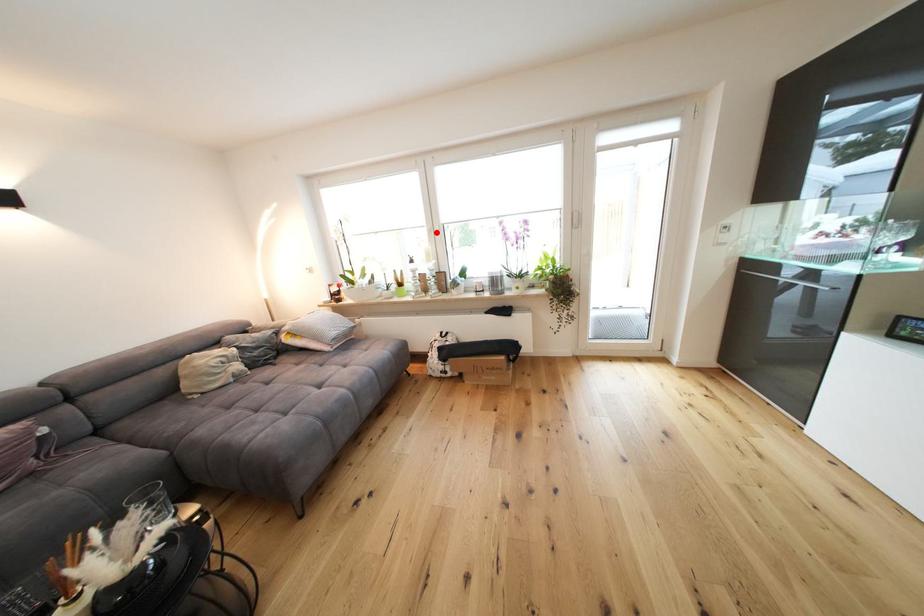
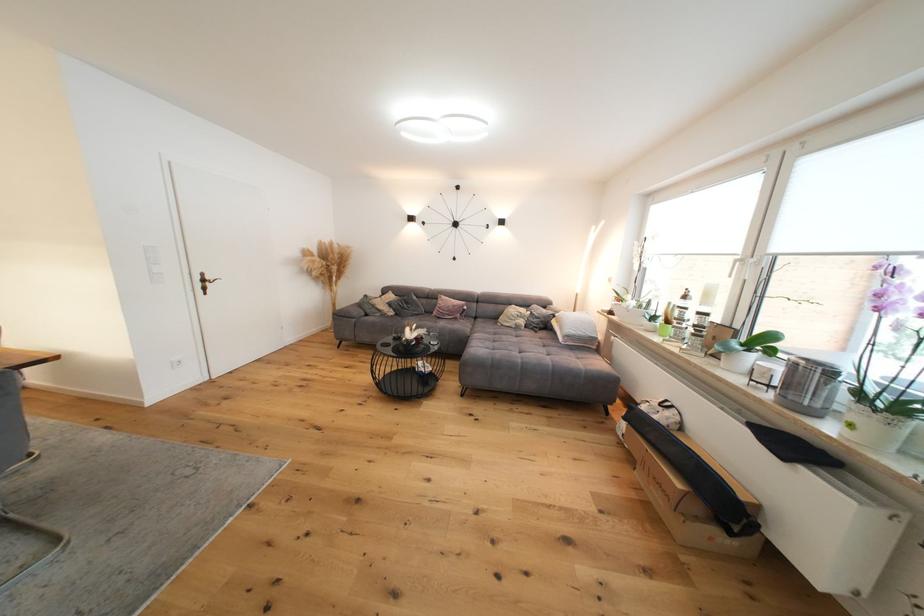
Question: I am providing you with two images of the same scene from different viewpoints. Given a red point in image1, look at the same physical point in image2. Is it:

Choices:
 (A) Closer to the viewpoint
 (B) Farther from the viewpoint

Answer: (B)